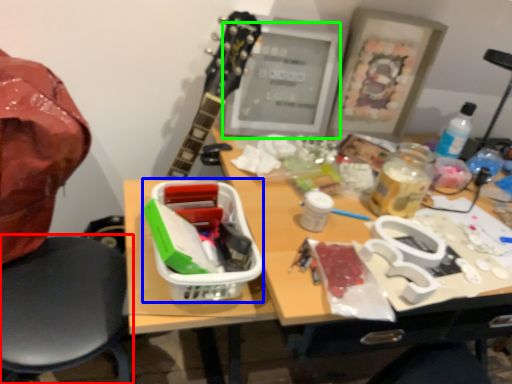
Question: Based on their relative distances, which object is farther from chair (highlighted by a red box)? Choose from lunch box (highlighted by a blue box) and computer monitor (highlighted by a green box).

Choices:
 (A) lunch box
 (B) computer monitor

Answer: (B)